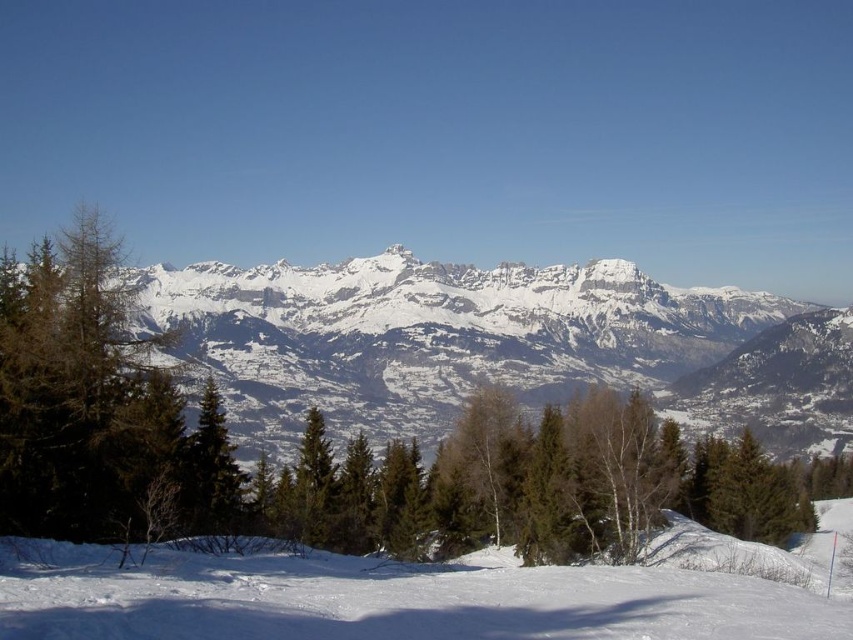
You are an explorer planning to cross the white powdery snow at lower center to reach the green matte tree at center. The snow can support your weight if the distance is less than 100 meters. Can you safely cross the snow to the tree?

The distance between the white powdery snow at lower center and the green matte tree at center is 98.48 meters, which is less than 100 meters. Therefore, you can safely cross the snow to the tree.

You are planning to build a snowman using the white powdery snow at lower center and need to place it near the green matte tree at center. Considering the space available, will there be enough room to build the snowman next to the tree without overcrowding the area?

The white powdery snow at lower center has a larger width than the green matte tree at center, so there should be sufficient space to build the snowman next to the tree without overcrowding the area.